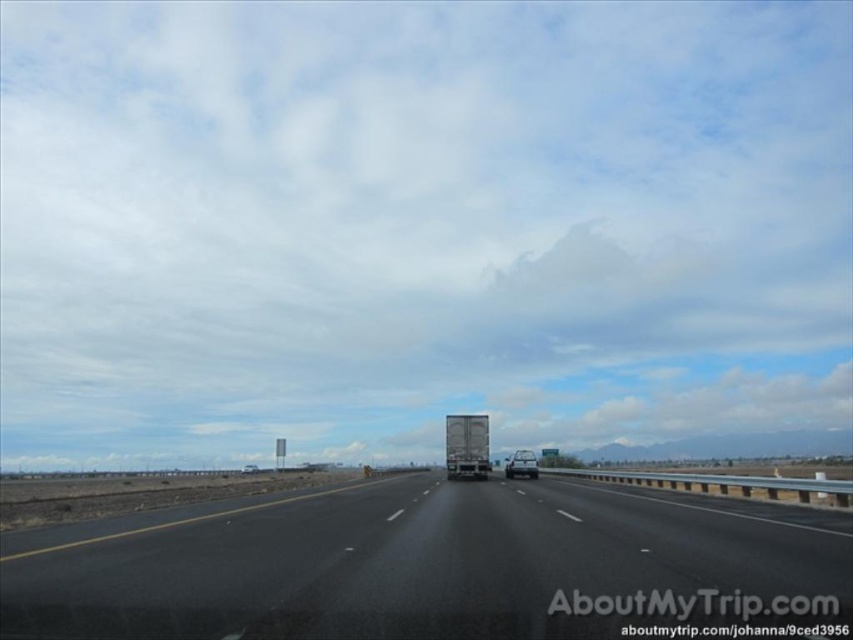
In the scene shown: You are driving a car and see the black asphalt highway at center and the silver metallic truck at center ahead. Which one is positioned more to the left from your perspective?

The black asphalt highway at center is positioned to the left of the silver metallic truck at center.

You are driving a car and want to overtake the silver metallic truck at center on the black asphalt highway at center. Based on the scene, can you safely do so without changing lanes?

The black asphalt highway at center is closer to the viewer than the silver metallic truck at center, meaning the truck is further away. Since the highway is straight and the truck is distant, there is enough space to safely overtake without changing lanes.

You are a photographer standing at the center of the highway, facing the direction of the large truck. You want to take a photo that includes both the point at coordinates point (431, 106) and point (421, 588). Which point will appear closer to the bottom edge of the photo?

Point (421, 588) will appear closer to the bottom edge of the photo because it is closer to the camera than point (431, 106).